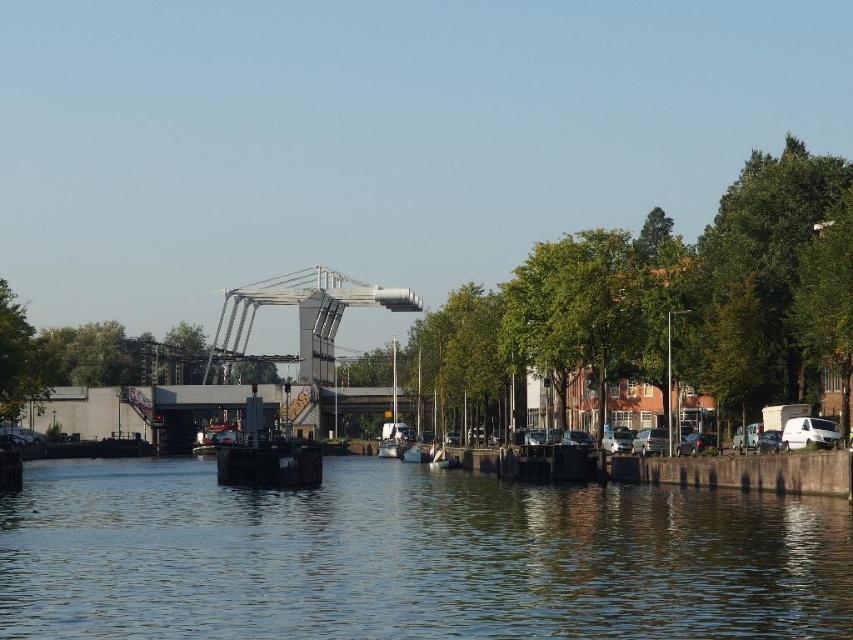
Question: Observing the image, what is the correct spatial positioning of blue water at center in reference to metallic gray boat at center?

Choices:
 (A) left
 (B) right

Answer: (B)

Question: Which object appears closest to the camera in this image?

Choices:
 (A) metallic gray boat at center
 (B) green leafy tree at center
 (C) green leafy tree at left

Answer: (B)

Question: Among these objects, which one is nearest to the camera?

Choices:
 (A) green leafy tree at left
 (B) metallic gray boat at center

Answer: (B)

Question: Is blue water at center positioned at the back of metallic gray boat at center?

Choices:
 (A) yes
 (B) no

Answer: (B)

Question: Is blue water at center thinner than green leafy tree at center?

Choices:
 (A) yes
 (B) no

Answer: (B)

Question: Which point appears farthest from the camera in this image?

Choices:
 (A) (222, 451)
 (B) (13, 362)

Answer: (B)